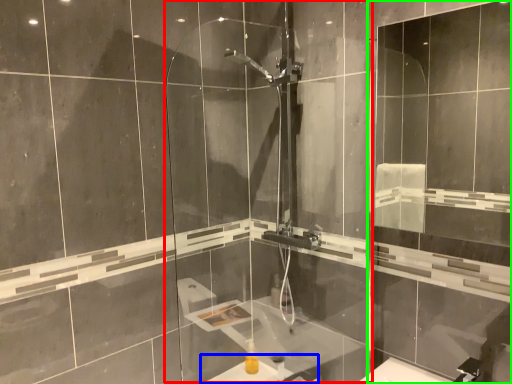
Question: Which object is the closest to the screen door (highlighted by a red box)? Choose among these: sink (highlighted by a blue box) or screen door (highlighted by a green box).

Choices:
 (A) sink
 (B) screen door

Answer: (A)